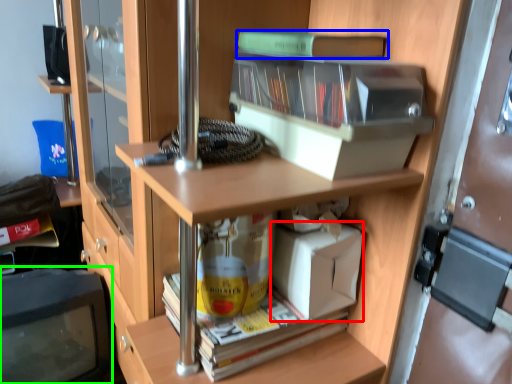
Question: Estimate the real-world distances between objects in this image. Which object is closer to box (highlighted by a red box), book (highlighted by a blue box) or computer monitor (highlighted by a green box)?

Choices:
 (A) book
 (B) computer monitor

Answer: (A)